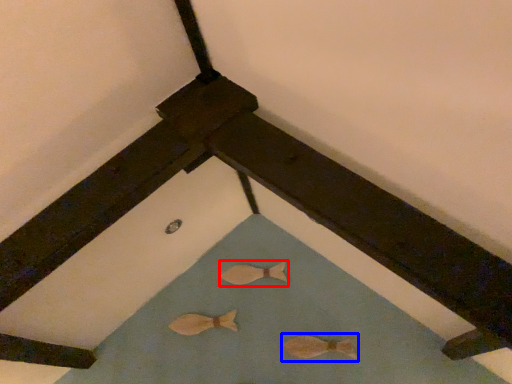
Question: Among these objects, which one is farthest to the camera, animal (highlighted by a red box) or animal (highlighted by a blue box)?

Choices:
 (A) animal
 (B) animal

Answer: (A)